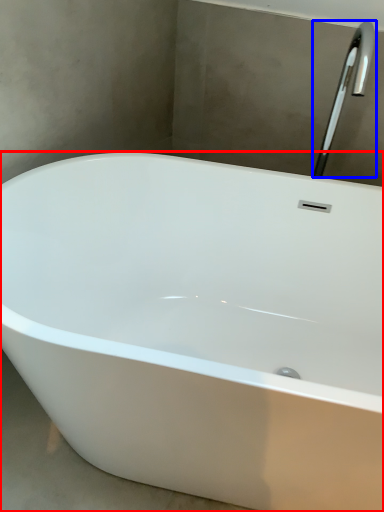
Question: Among these objects, which one is farthest to the camera, bathtub (highlighted by a red box) or tap (highlighted by a blue box)?

Choices:
 (A) bathtub
 (B) tap

Answer: (B)